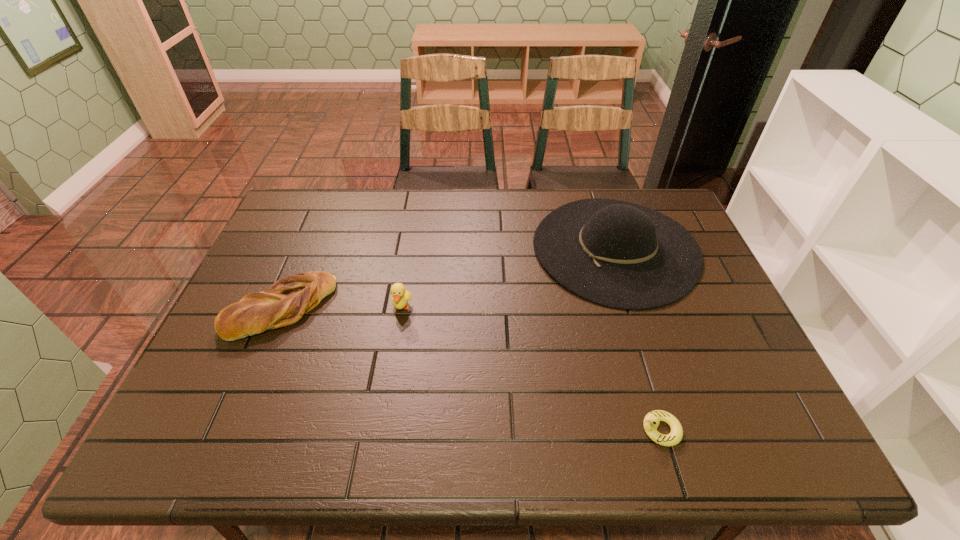
Image resolution: width=960 pixels, height=540 pixels. In order to click on the tallest object in this screenshot , I will do `click(618, 254)`.

The image size is (960, 540). In order to click on the second object from left to right in this screenshot , I will do `click(400, 296)`.

I want to click on the farther duckling, so click(x=400, y=296).

This screenshot has height=540, width=960. What are the coordinates of `bread` in the screenshot? It's located at pos(288,299).

You are a GUI agent. You are given a task and a screenshot of the screen. Output one action in this format:
    pyautogui.click(x=<x>, y=<y>)
    Task: Click on the second shortest object
    Image resolution: width=960 pixels, height=540 pixels.
    Given the screenshot: What is the action you would take?
    coord(288,299)

Locate an element on the screen. The width and height of the screenshot is (960, 540). the nearest object is located at coordinates (651, 421).

Where is `the right duckling`? This screenshot has width=960, height=540. the right duckling is located at coordinates (651, 421).

The image size is (960, 540). What are the coordinates of `vacant region located 0.080m on the front-facing side of the sombrero` in the screenshot? It's located at (508, 248).

Find the location of `free spot located on the front-facing side of the sombrero`. free spot located on the front-facing side of the sombrero is located at coordinates (407, 248).

Where is `free space located 0.170m on the front-facing side of the sombrero`? The image size is (960, 540). free space located 0.170m on the front-facing side of the sombrero is located at coordinates (478, 248).